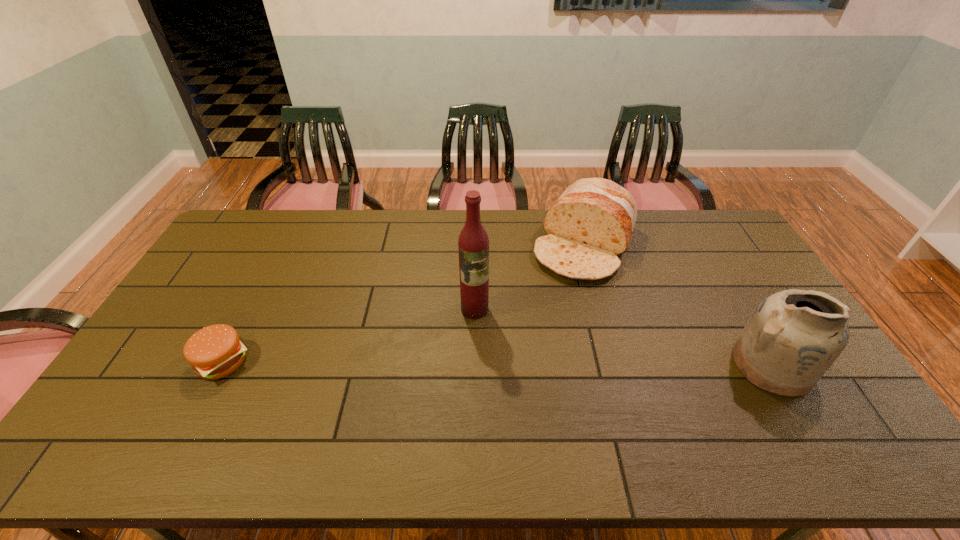
You are a GUI agent. You are given a task and a screenshot of the screen. Output one action in this format:
    pyautogui.click(x=<x>, y=<y>)
    Task: Click on the vacant point located between the liquor and the pottery
    
    Given the screenshot: What is the action you would take?
    pyautogui.click(x=623, y=337)

Image resolution: width=960 pixels, height=540 pixels. What are the coordinates of `vacant space that is in between the second shortest object and the second object from left to right` in the screenshot? It's located at (530, 277).

Locate an element on the screen. vacant area that lies between the pottery and the third nearest object is located at coordinates (623, 337).

Where is `free space between the second shortest object and the rightmost object`? The height and width of the screenshot is (540, 960). free space between the second shortest object and the rightmost object is located at coordinates (678, 305).

Identify the location of empty location between the leftmost object and the second shortest object. This screenshot has height=540, width=960. (404, 303).

Locate an element on the screen. The height and width of the screenshot is (540, 960). unoccupied area between the farthest object and the hamburger is located at coordinates (404, 303).

The height and width of the screenshot is (540, 960). In order to click on free space between the farthest object and the second object from left to right in this screenshot , I will do `click(530, 277)`.

Find the location of a particular element. The height and width of the screenshot is (540, 960). vacant space that's between the liquor and the rightmost object is located at coordinates tap(623, 337).

This screenshot has height=540, width=960. Identify the location of the second closest object relative to the tallest object. (215, 351).

Where is `the third closest object to the bread`? Image resolution: width=960 pixels, height=540 pixels. the third closest object to the bread is located at coordinates (215, 351).